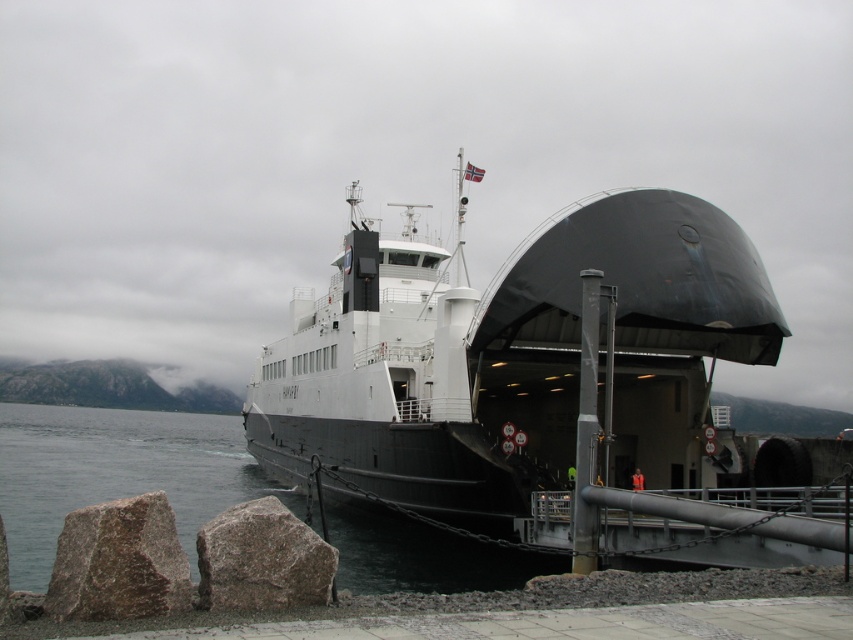
You are a sailor on the ferry and need to secure the anchor chain. The anchor chain is attached to the black matte ship at center. Where should you direct the anchor to ensure it reaches the granite rock at lower left?

The anchor should be directed towards the granite rock at lower left because the black matte ship at center is above it, so dropping the anchor straight down would reach the granite rock at lower left.